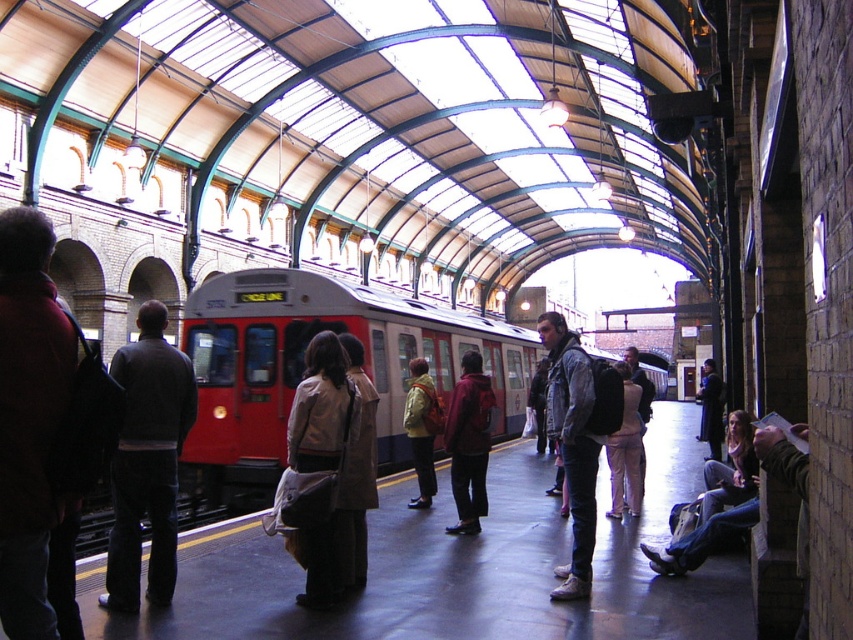
Is point (16, 314) in front of point (112, 605)?

That is True.

Where is `red jacket at left`? This screenshot has width=853, height=640. red jacket at left is located at coordinates (28, 417).

Does red matte train at center lie in front of yellow fabric jacket at center?

That is False.

Who is shorter, red matte train at center or yellow fabric jacket at center?

yellow fabric jacket at center

I want to click on red matte train at center, so click(303, 365).

Which is in front, point (296, 355) or point (49, 529)?

Positioned in front is point (49, 529).

Is red matte train at center wider than red jacket at left?

Correct, the width of red matte train at center exceeds that of red jacket at left.

Is point (283, 362) more distant than point (61, 378)?

That is True.

The width and height of the screenshot is (853, 640). Identify the location of red matte train at center. (303, 365).